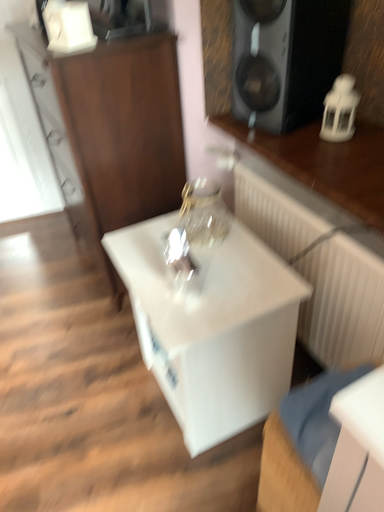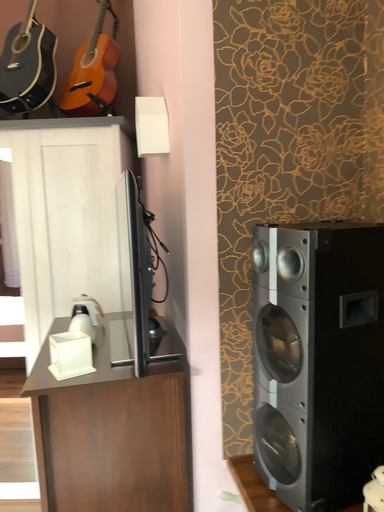
Question: How did the camera likely rotate when shooting the video?

Choices:
 (A) rotated left
 (B) rotated right

Answer: (A)